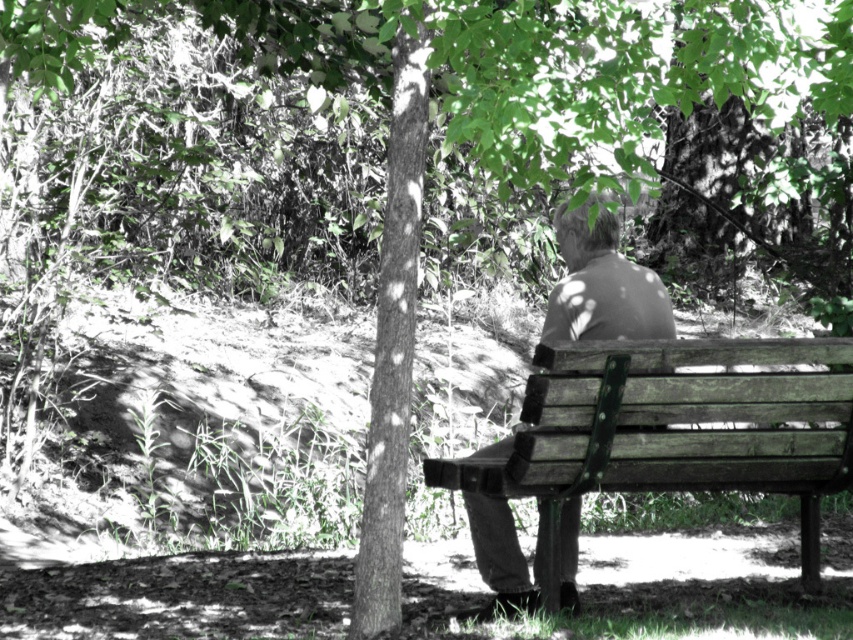
You are standing at the point marked by coordinates point (672,429). Looking around, you see the wooden bench at lower right. Is the wooden bench at lower right located to your left or right side?

The point (672,429) indicates the wooden bench at lower right, so you are standing directly at the wooden bench at lower right.

Based on the coordinates provided, where is the wooden bench at lower right located in the image?

The wooden bench at lower right is located at point 0.672 on the x axis and 0.790 on the y axis.

You are planning to place a small potted plant between the wooden bench at lower right and the matte brown jacket at center. Given their sizes, which object should the plant be closer to?

The wooden bench at lower right is larger in size than the matte brown jacket at center, so the plant should be placed closer to the matte brown jacket at center to maintain balance.